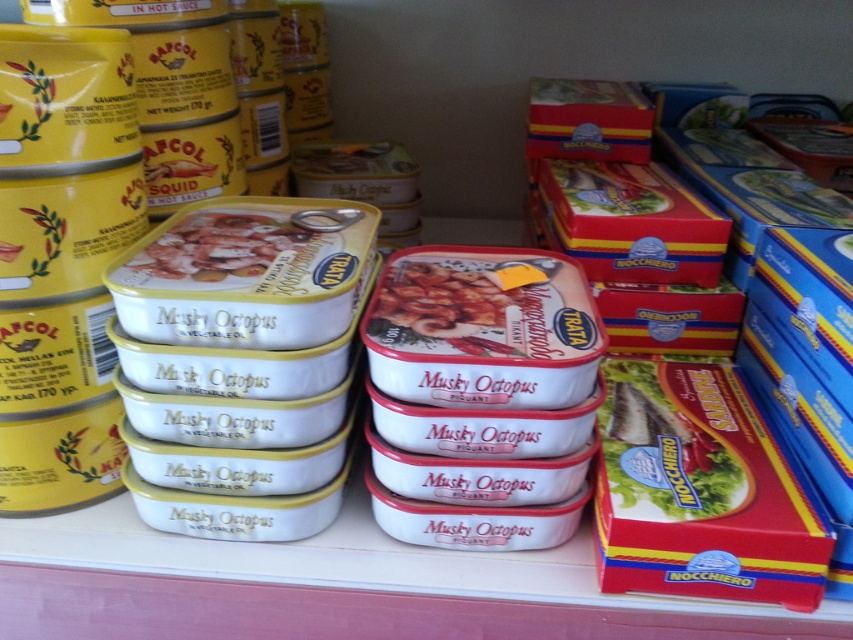
Does matte cardboard fish at center right have a larger size compared to white glossy musky octopus at center?

Indeed, matte cardboard fish at center right has a larger size compared to white glossy musky octopus at center.

The image size is (853, 640). What do you see at coordinates (663, 445) in the screenshot? I see `matte cardboard fish at center right` at bounding box center [663, 445].

The height and width of the screenshot is (640, 853). Identify the location of matte cardboard fish at center right. (663, 445).

Who is shorter, red cardboard box at right or white matte musky octopus at center?

With less height is white matte musky octopus at center.

From the picture: Is red cardboard box at right taller than white matte musky octopus at center?

Correct, red cardboard box at right is much taller as white matte musky octopus at center.

Describe the element at coordinates (701, 490) in the screenshot. I see `red cardboard box at right` at that location.

I want to click on red cardboard box at right, so click(701, 490).

Does point (764, 502) lie behind point (230, 275)?

No, (764, 502) is closer to viewer.

Is red cardboard box at right to the left of white glossy musky octopus at center from the viewer's perspective?

In fact, red cardboard box at right is to the right of white glossy musky octopus at center.

Who is more distant from viewer, (708, 417) or (235, 275)?

Point (708, 417)

Locate an element on the screen. The width and height of the screenshot is (853, 640). red cardboard box at right is located at coordinates (701, 490).